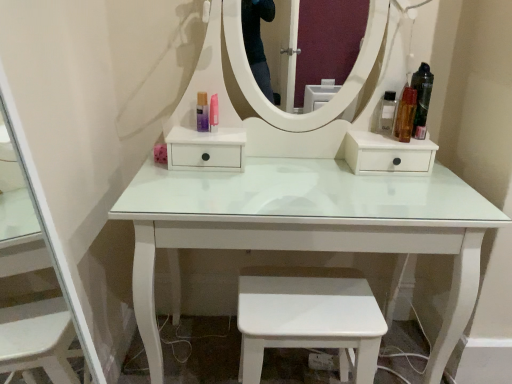
Question: Is white glossy step stool at lower center in front of or behind translucent amber bottle at right, the 2th toiletry viewed from the right, in the image?

Choices:
 (A) behind
 (B) front

Answer: (B)

Question: From the image's perspective, is white glossy step stool at lower center located above or below translucent amber bottle at right, the 2th toiletry viewed from the right?

Choices:
 (A) below
 (B) above

Answer: (A)

Question: Considering the real-world distances, which object is closest to the satin silver spray can at right, the 3th toiletry when ordered from right to left?

Choices:
 (A) translucent amber bottle at right, which appears as the 4th toiletry when viewed from the left
 (B) shiny black hair spray at upper right, which is the 5th toiletry in left-to-right order
 (C) translucent purple bottle at center, arranged as the 5th toiletry when viewed from the right
 (D) white glossy step stool at lower center
 (E) pink glossy lipstick at center, which is counted as the 2th toiletry, starting from the left

Answer: (A)

Question: Which of these objects is positioned farthest from the shiny black hair spray at upper right, which ranks as the 1th toiletry in right-to-left order?

Choices:
 (A) satin silver spray can at right, which appears as the third toiletry when viewed from the left
 (B) pink glossy lipstick at center, which is the fourth toiletry in right-to-left order
 (C) translucent purple bottle at center, arranged as the 5th toiletry when viewed from the right
 (D) white glossy step stool at lower center
 (E) translucent amber bottle at right, which appears as the 4th toiletry when viewed from the left

Answer: (C)